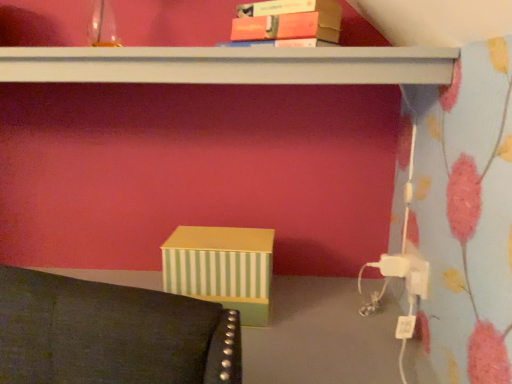
Measure the distance between point [365,65] and camera.

Point [365,65] and camera are 29.61 inches apart from each other.

Describe the element at coordinates (228, 65) in the screenshot. The image size is (512, 384). I see `white matte shelf at upper center` at that location.

The image size is (512, 384). What do you see at coordinates (286, 22) in the screenshot? I see `matte orange book at upper center` at bounding box center [286, 22].

Measure the distance between matte orange book at upper center and camera.

matte orange book at upper center and camera are 33.33 inches apart from each other.

At what (x,y) coordinates should I click in order to perform the action: click on white matte shelf at upper center. Please return your answer as a coordinate pair (x, y). The height and width of the screenshot is (384, 512). Looking at the image, I should click on (228, 65).

Is white plastic plug at lower right positioned with its back to white matte shelf at upper center?

No, white matte shelf at upper center is not at the back of white plastic plug at lower right.

Which of these two, white plastic plug at lower right or white matte shelf at upper center, is smaller?

white plastic plug at lower right.

Which of these two, white plastic plug at lower right or white matte shelf at upper center, stands shorter?

With less height is white plastic plug at lower right.

Which of these two, matte orange book at upper center or white plastic plug at lower right, is thinner?

white plastic plug at lower right is thinner.

Is matte orange book at upper center bigger or smaller than white plastic plug at lower right?

In the image, matte orange book at upper center appears to be larger than white plastic plug at lower right.

Which is more to the left, matte orange book at upper center or white plastic plug at lower right?

matte orange book at upper center.

From a real-world perspective, which is physically below, matte orange book at upper center or white plastic plug at lower right?

white plastic plug at lower right is physically lower.

Would you say white matte shelf at upper center is to the left or to the right of white plastic plug at lower right in the picture?

white matte shelf at upper center is to the left of white plastic plug at lower right.

Looking at their sizes, would you say white matte shelf at upper center is wider or thinner than white plastic plug at lower right?

white matte shelf at upper center is wider than white plastic plug at lower right.

From the image's perspective, is white matte shelf at upper center beneath white plastic plug at lower right?

No, from the image's perspective, white matte shelf at upper center is not beneath white plastic plug at lower right.

Does white matte shelf at upper center have a greater height compared to white plastic plug at lower right?

Yes.

Consider the image. Is white plastic plug at lower right not within matte orange book at upper center?

That's correct, white plastic plug at lower right is outside of matte orange book at upper center.

Is the depth of white plastic plug at lower right less than that of matte orange book at upper center?

No, white plastic plug at lower right is behind matte orange book at upper center.

Between white plastic plug at lower right and matte orange book at upper center, which one has larger width?

Wider between the two is matte orange book at upper center.

From the image's perspective, who appears lower, white plastic plug at lower right or matte orange book at upper center?

white plastic plug at lower right appears lower in the image.

Is white matte shelf at upper center turned away from matte orange book at upper center?

No, matte orange book at upper center is not at the back of white matte shelf at upper center.

Between white matte shelf at upper center and matte orange book at upper center, which one appears on the left side from the viewer's perspective?

Positioned to the left is white matte shelf at upper center.

In the scene shown: Considering the sizes of white matte shelf at upper center and matte orange book at upper center in the image, is white matte shelf at upper center taller or shorter than matte orange book at upper center?

Clearly, white matte shelf at upper center is shorter compared to matte orange book at upper center.

Is white matte shelf at upper center far from matte orange book at upper center?

No, there isn't a large distance between white matte shelf at upper center and matte orange book at upper center.

Is matte orange book at upper center turned away from white matte shelf at upper center?

No, matte orange book at upper center is not facing the opposite direction of white matte shelf at upper center.

In the image, is matte orange book at upper center on the left side or the right side of white matte shelf at upper center?

matte orange book at upper center is positioned on white matte shelf at upper center's right side.

How many degrees apart are the facing directions of matte orange book at upper center and white matte shelf at upper center?

The angular difference between matte orange book at upper center and white matte shelf at upper center is 28.3 degrees.

From a real-world perspective, is matte orange book at upper center located higher than white matte shelf at upper center?

Yes, from a real-world perspective, matte orange book at upper center is over white matte shelf at upper center

The width and height of the screenshot is (512, 384). In order to click on plug that is on the right side of white matte shelf at upper center in this screenshot , I will do `click(394, 265)`.

Image resolution: width=512 pixels, height=384 pixels. What are the coordinates of `book above the white plastic plug at lower right (from the image's perspective)` in the screenshot? It's located at (286, 22).

Estimate the real-world distances between objects in this image. Which object is further from white plastic plug at lower right, white matte shelf at upper center or matte orange book at upper center?

Based on the image, matte orange book at upper center appears to be further to white plastic plug at lower right.

Considering their positions, is white plastic plug at lower right positioned further to matte orange book at upper center than white matte shelf at upper center?

Based on the image, white plastic plug at lower right appears to be further to matte orange book at upper center.

Estimate the real-world distances between objects in this image. Which object is further from white plastic plug at lower right, matte orange book at upper center or white matte shelf at upper center?

matte orange book at upper center is further to white plastic plug at lower right.

When comparing their distances from matte orange book at upper center, does white matte shelf at upper center or white plastic plug at lower right seem further?

white plastic plug at lower right is further to matte orange book at upper center.

From the image, which object appears to be nearer to white matte shelf at upper center, white plastic plug at lower right or matte orange book at upper center?

matte orange book at upper center.

Which object lies further to the anchor point white matte shelf at upper center, matte orange book at upper center or white plastic plug at lower right?

white plastic plug at lower right lies further to white matte shelf at upper center than the other object.

The height and width of the screenshot is (384, 512). I want to click on shelf between matte orange book at upper center and white plastic plug at lower right from top to bottom, so pyautogui.click(x=228, y=65).